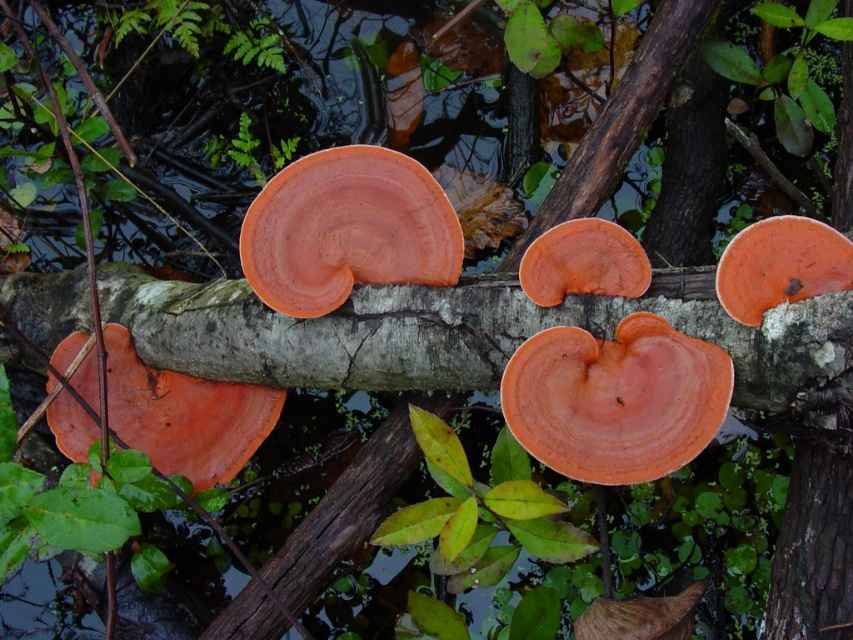
Question: Where is orange matte fungus at center located in relation to smooth bark tree trunk at right in the image?

Choices:
 (A) below
 (B) above

Answer: (B)

Question: Among these objects, which one is farthest from the camera?

Choices:
 (A) orange matte fungus at center
 (B) smooth bark tree trunk at right

Answer: (A)

Question: Can you confirm if orange matte fungus at center is positioned above smooth bark tree trunk at right?

Choices:
 (A) no
 (B) yes

Answer: (B)

Question: Is orange matte fungus at center above smooth bark tree trunk at right?

Choices:
 (A) no
 (B) yes

Answer: (B)

Question: Which of the following is the farthest from the observer?

Choices:
 (A) (792, 580)
 (B) (430, 230)

Answer: (B)